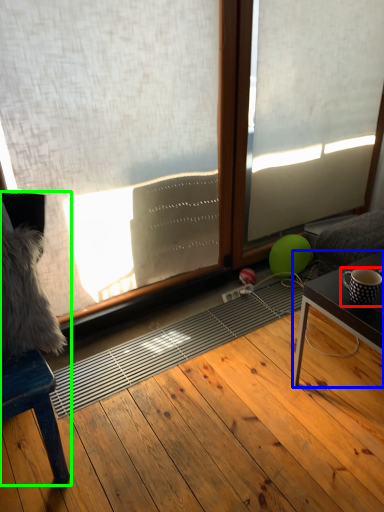
Question: Estimate the real-world distances between objects in this image. Which object is farther from coffee cup (highlighted by a red box), table (highlighted by a blue box) or furniture (highlighted by a green box)?

Choices:
 (A) table
 (B) furniture

Answer: (B)